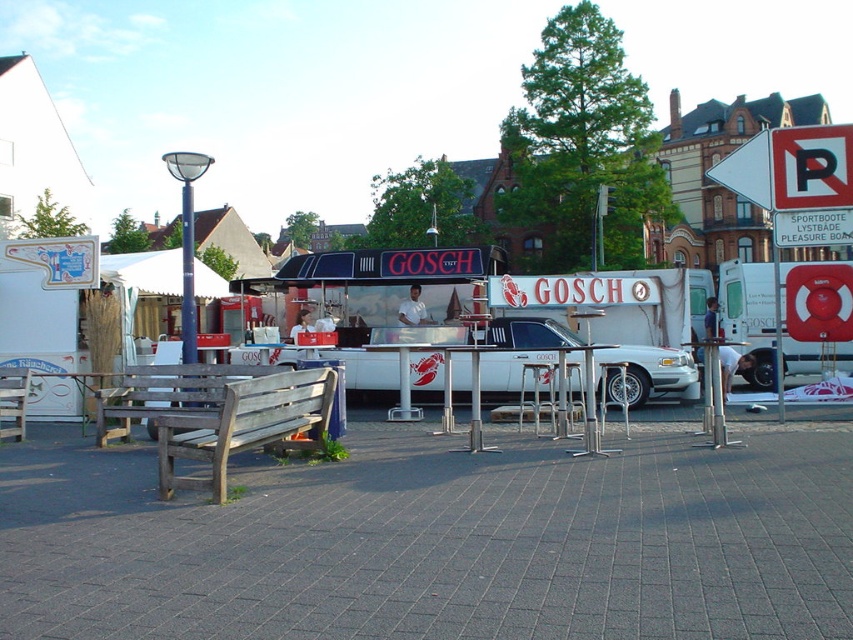
How distant is white glossy food truck at center from wooden bench at lower left?

A distance of 4.31 meters exists between white glossy food truck at center and wooden bench at lower left.

Is white glossy food truck at center below wooden bench at lower left?

Result: Incorrect, white glossy food truck at center is not positioned below wooden bench at lower left.

Find the location of a particular element. white glossy food truck at center is located at coordinates (419, 304).

Where is `white glossy food truck at center`? white glossy food truck at center is located at coordinates (419, 304).

Does white metallic car at center appear under wooden bench at lower left?

Actually, white metallic car at center is above wooden bench at lower left.

Is point (663, 380) farther from viewer compared to point (120, 428)?

Yes, point (663, 380) is behind point (120, 428).

Find the location of a particular element. white metallic car at center is located at coordinates (521, 348).

Between wooden park bench at lower left and wooden bench at center, which one appears on the right side from the viewer's perspective?

wooden park bench at lower left is more to the right.

Who is more distant from viewer, [213,449] or [0,429]?

The point [0,429] is more distant.

At what (x,y) coordinates should I click in order to perform the action: click on wooden park bench at lower left. Please return your answer as a coordinate pair (x, y). The height and width of the screenshot is (640, 853). Looking at the image, I should click on (245, 426).